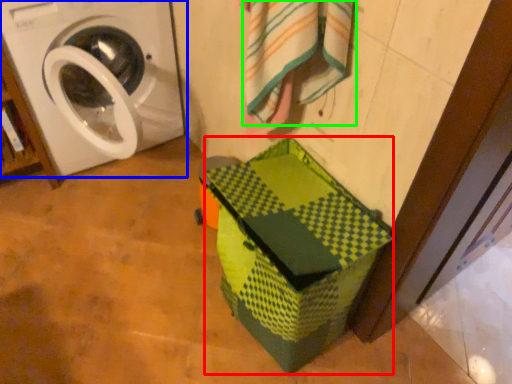
Question: Which object is the closest to the cardboard box (highlighted by a red box)? Choose among these: washing machine (highlighted by a blue box) or bath towel (highlighted by a green box).

Choices:
 (A) washing machine
 (B) bath towel

Answer: (B)